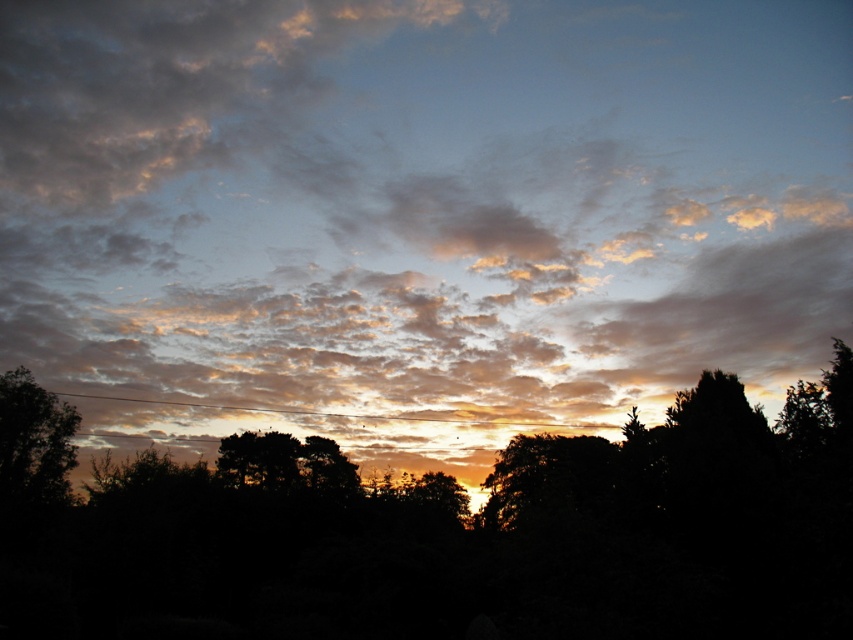
You are an artist trying to paint the sunset scene. You want to ensure the cloudy sky at center and the dark green leafy tree at lower left are proportionally accurate. Which one should you make larger in your painting?

The cloudy sky at center should be made larger than the dark green leafy tree at lower left in the painting since it has a larger size compared to the tree.

In the scene shown: You are an astronomer observing the sunset scene. You notice two points in the image, one at coordinates point [577,349] and another at point [27,499]. Which point is closer to the horizon?

Point [27,499] is closer to the horizon because it has a lower y coordinate value than point [577,349].

In the sunset scene, you see a silhouette tree at center and a dark green leafy tree at lower left. Which tree is positioned more to the east?

The dark green leafy tree at lower left is positioned more to the east because the silhouette tree at center is to the right of it, and since the sun is setting in the west, the eastern side would be to the left.